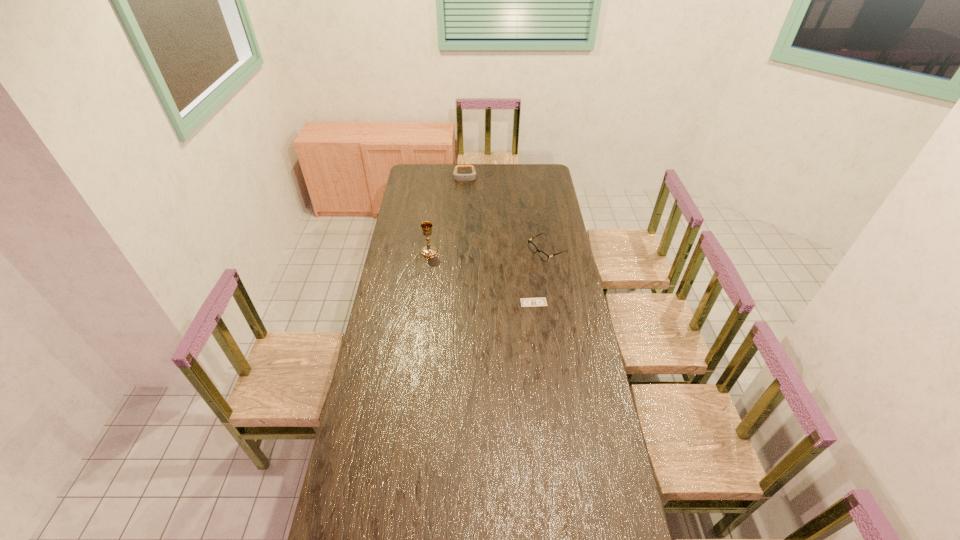
Image resolution: width=960 pixels, height=540 pixels. I want to click on free space located on the front-facing side of the spectacles, so click(x=518, y=265).

Where is `vacant space located on the front-facing side of the spectacles`? vacant space located on the front-facing side of the spectacles is located at coordinates (481, 284).

I want to click on blank space located on the front and back of the farthest object, so click(466, 221).

Locate an element on the screen. blank space located on the front and back of the farthest object is located at coordinates (466, 201).

Find the location of a particular element. This screenshot has width=960, height=540. vacant position located on the front and back of the farthest object is located at coordinates (466, 200).

Locate an element on the screen. Image resolution: width=960 pixels, height=540 pixels. object present at the far edge is located at coordinates (458, 177).

The width and height of the screenshot is (960, 540). What are the coordinates of `object that is at the left edge` in the screenshot? It's located at (428, 251).

Locate an element on the screen. This screenshot has height=540, width=960. money located at the right edge is located at coordinates (525, 302).

Image resolution: width=960 pixels, height=540 pixels. Identify the location of spectacles present at the right edge. (533, 248).

Locate an element on the screen. free space at the far edge is located at coordinates (436, 181).